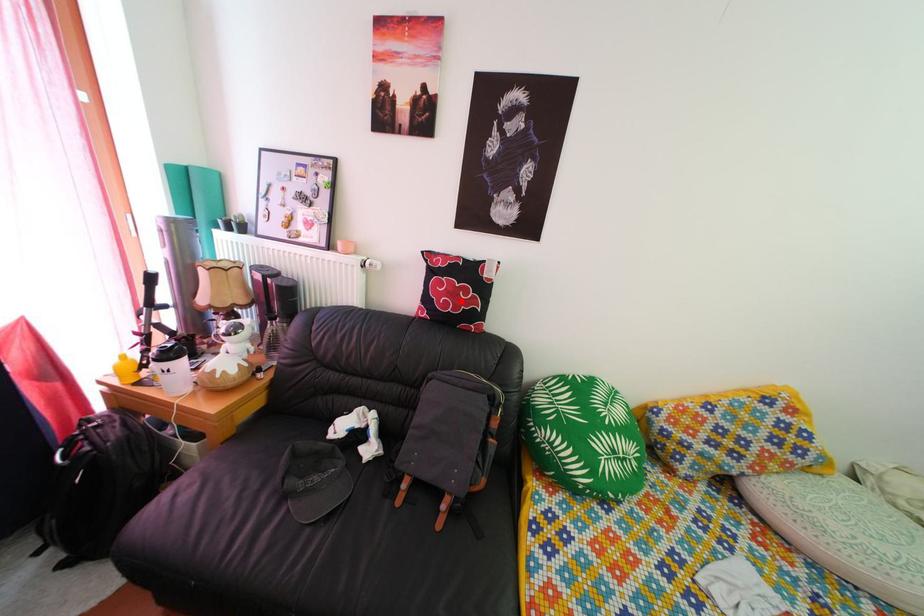
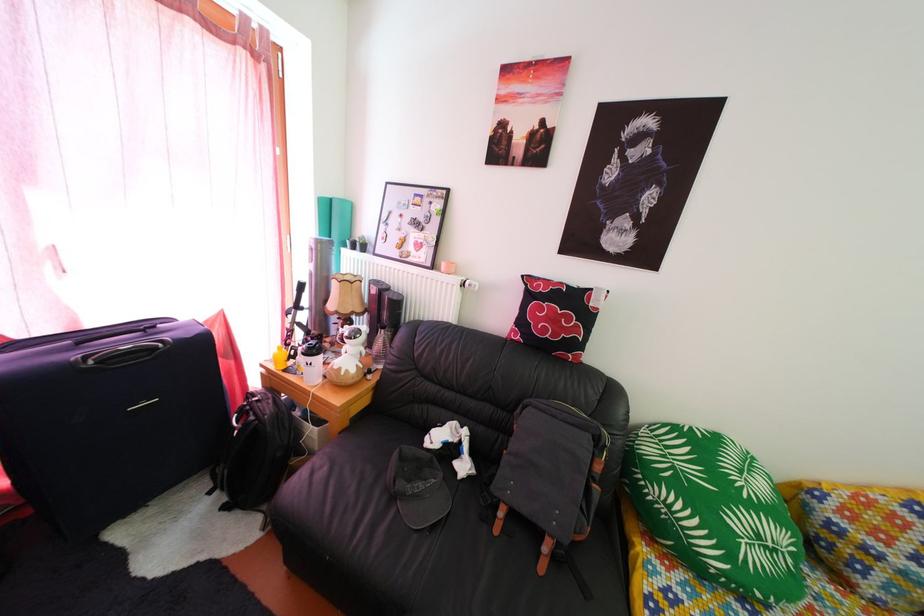
Where in the second image is the point corresponding to the highlighted location from the first image?

(562, 328)